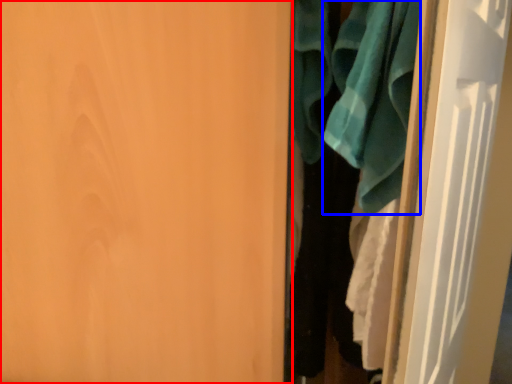
Question: Which point is further to the camera, door (highlighted by a red box) or bath towel (highlighted by a blue box)?

Choices:
 (A) door
 (B) bath towel

Answer: (B)